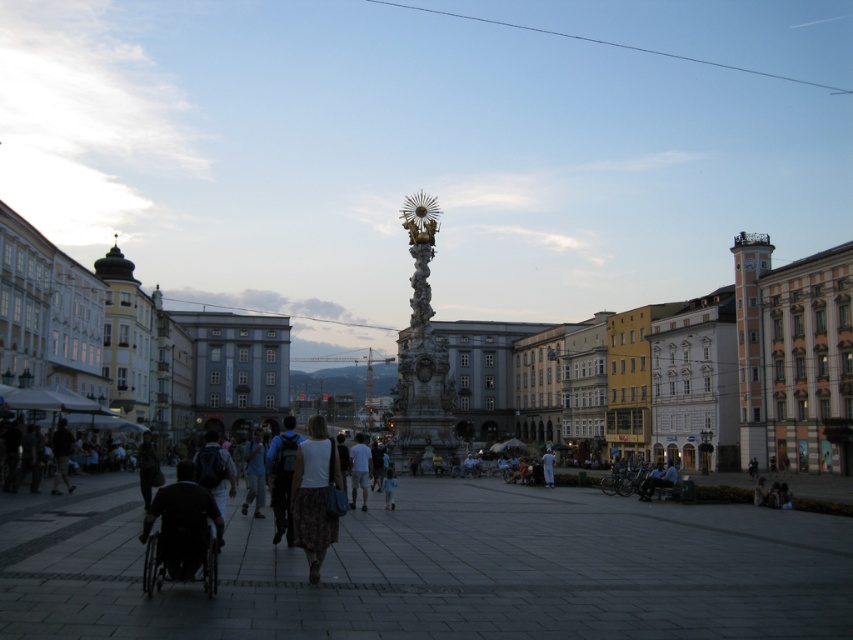
This screenshot has width=853, height=640. What do you see at coordinates (282, 477) in the screenshot?
I see `dark blue backpack at center` at bounding box center [282, 477].

Which is behind, point (274, 451) or point (367, 456)?

The point (367, 456) is more distant.

Between point (283, 440) and point (351, 476), which one is positioned behind?

The point (351, 476) is more distant.

At what (x,y) coordinates should I click in order to perform the action: click on dark blue backpack at center. Please return your answer as a coordinate pair (x, y). The width and height of the screenshot is (853, 640). Looking at the image, I should click on tap(282, 477).

Which is above, dark blue backpack at center or light blue denim jeans at center?

dark blue backpack at center is above.

Does dark blue backpack at center have a larger size compared to light blue denim jeans at center?

Incorrect, dark blue backpack at center is not larger than light blue denim jeans at center.

This screenshot has width=853, height=640. I want to click on dark blue backpack at center, so click(x=282, y=477).

Consider the image. Is light blue denim jeans at center thinner than light gray cotton shorts at center?

In fact, light blue denim jeans at center might be wider than light gray cotton shorts at center.

Can you confirm if light blue denim jeans at center is wider than light gray cotton shorts at center?

Indeed, light blue denim jeans at center has a greater width compared to light gray cotton shorts at center.

Identify the location of light blue denim jeans at center. (254, 474).